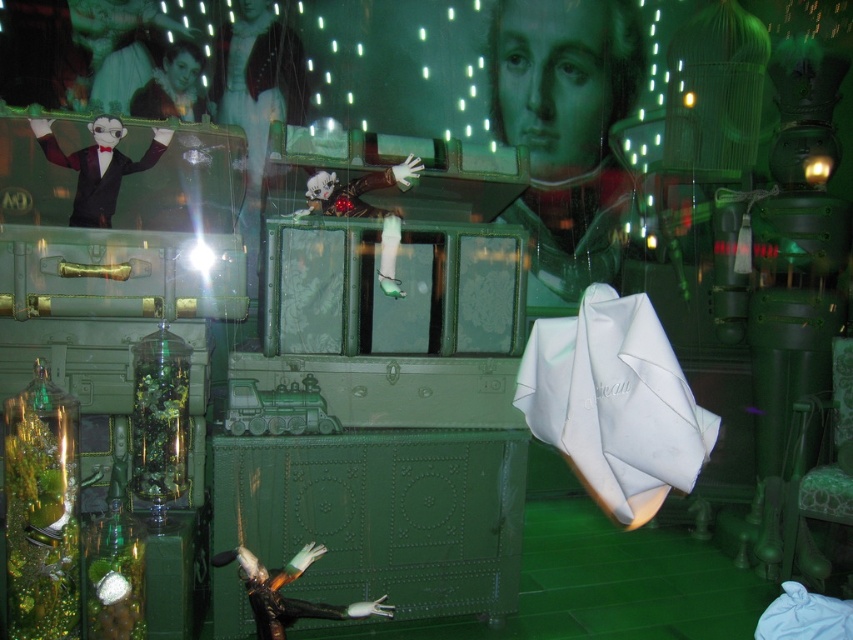
Can you confirm if smooth green portrait at upper center is shorter than matte black suit at upper left?

Incorrect, smooth green portrait at upper center's height does not fall short of matte black suit at upper left's.

Is smooth green portrait at upper center smaller than matte black suit at upper left?

No, smooth green portrait at upper center is not smaller than matte black suit at upper left.

You are a GUI agent. You are given a task and a screenshot of the screen. Output one action in this format:
    pyautogui.click(x=<x>, y=<y>)
    Task: Click on the smooth green portrait at upper center
    
    Given the screenshot: What is the action you would take?
    pyautogui.click(x=566, y=131)

Who is positioned more to the left, smooth green portrait at upper center or shiny silver figurine at center?

From the viewer's perspective, shiny silver figurine at center appears more on the left side.

Based on the photo, is smooth green portrait at upper center bigger than shiny silver figurine at center?

Yes.

Which is behind, point (502, 35) or point (323, 548)?

The point (502, 35) is more distant.

Locate an element on the screen. The width and height of the screenshot is (853, 640). smooth green portrait at upper center is located at coordinates (566, 131).

Based on the photo, between white satin umbrella at center right and matte black suit at upper left, which one has less height?

With less height is matte black suit at upper left.

Does white satin umbrella at center right have a larger size compared to matte black suit at upper left?

Yes, white satin umbrella at center right is bigger than matte black suit at upper left.

Which is in front, point (685, 440) or point (44, 152)?

Point (685, 440) is in front.

Where is `white satin umbrella at center right`? white satin umbrella at center right is located at coordinates 614,403.